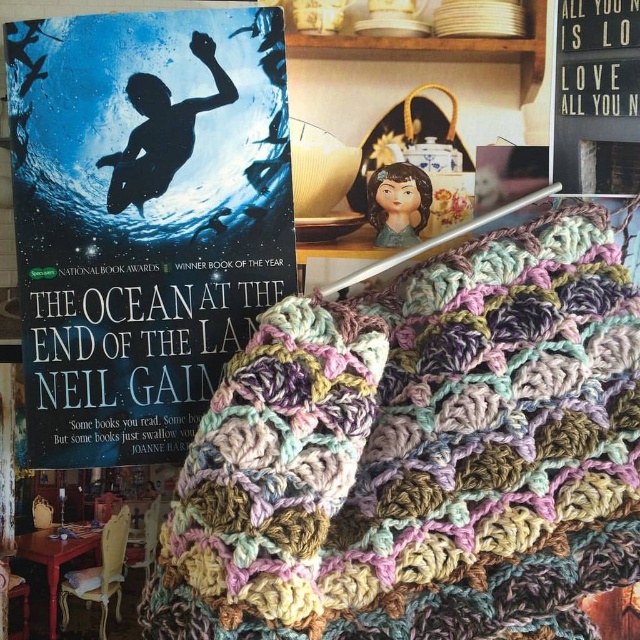
Is multicolored crocheted blanket at center above wooden signboard at upper right?

No.

Is multicolored crocheted blanket at center taller than wooden signboard at upper right?

Yes.

Who is more forward, (420, 611) or (557, 179)?

Point (420, 611)

The width and height of the screenshot is (640, 640). What are the coordinates of `multicolored crocheted blanket at center` in the screenshot? It's located at (420, 454).

Which of these two, multicolored crocheted blanket at center or matte paper book at left, stands shorter?

multicolored crocheted blanket at center is shorter.

Describe the element at coordinates (420, 454) in the screenshot. Image resolution: width=640 pixels, height=640 pixels. I see `multicolored crocheted blanket at center` at that location.

The height and width of the screenshot is (640, 640). I want to click on multicolored crocheted blanket at center, so click(x=420, y=454).

Is matte paper book at left below wooden signboard at upper right?

Yes.

Between matte paper book at left and wooden signboard at upper right, which one is positioned higher?

wooden signboard at upper right is higher up.

Which is in front, point (68, 164) or point (564, 56)?

Point (68, 164)

Identify the location of matte paper book at left. (144, 220).